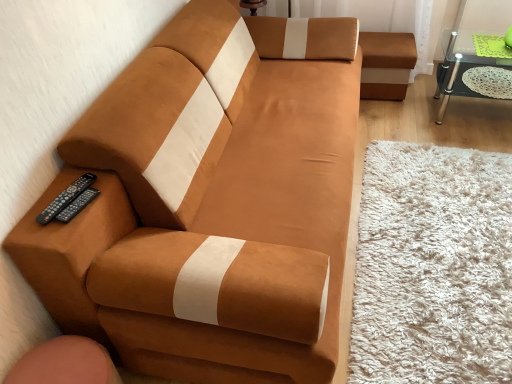
Measure the distance between black plastic remote at lower left, which is counted as the second remote, starting from the right, and camera.

black plastic remote at lower left, which is counted as the second remote, starting from the right, is 1.25 meters away from camera.

In order to face suede-like brown couch at left, should I rotate leftwards or rightwards?

To face it directly, rotate left by 0.041 degrees.

Describe the element at coordinates (77, 205) in the screenshot. I see `black plastic remote at lower left, the 1th remote when ordered from right to left` at that location.

Identify the location of black plastic remote at lower left, which is counted as the second remote, starting from the right. 65,198.

Which is less distant, (93,257) or (467,88)?

Positioned in front is point (93,257).

From the image's perspective, which one is positioned lower, suede-like brown couch at left or transparent glass table at upper right?

suede-like brown couch at left is shown below in the image.

Does suede-like brown couch at left appear on the right side of transparent glass table at upper right?

No, suede-like brown couch at left is not to the right of transparent glass table at upper right.

From a real-world perspective, between suede-like brown couch at left and transparent glass table at upper right, who is vertically lower?

transparent glass table at upper right is physically lower.

Is suede-like brown couch at left facing towards black plastic remote at lower left, the 1th remote when ordered from right to left?

No, suede-like brown couch at left is not facing towards black plastic remote at lower left, the 1th remote when ordered from right to left.

From their relative heights in the image, would you say suede-like brown couch at left is taller or shorter than black plastic remote at lower left, positioned as the second remote in left-to-right order?

suede-like brown couch at left is taller than black plastic remote at lower left, positioned as the second remote in left-to-right order.

Considering the relative positions of suede-like brown couch at left and black plastic remote at lower left, the 1th remote when ordered from right to left, in the image provided, is suede-like brown couch at left to the left of black plastic remote at lower left, the 1th remote when ordered from right to left, from the viewer's perspective?

No.

Locate an element on the screen. Image resolution: width=512 pixels, height=384 pixels. remote that is the 1st object to the left of the suede-like brown couch at left, starting at the anchor is located at coordinates (77, 205).

In terms of width, does black plastic remote at lower left, which ranks as the first remote in left-to-right order, look wider or thinner when compared to black plastic remote at lower left, the 1th remote when ordered from right to left?

In the image, black plastic remote at lower left, which ranks as the first remote in left-to-right order, appears to be wider than black plastic remote at lower left, the 1th remote when ordered from right to left.

What's the angular difference between black plastic remote at lower left, which is counted as the second remote, starting from the right, and black plastic remote at lower left, positioned as the second remote in left-to-right order,'s facing directions?

6.25 degrees separate the facing orientations of black plastic remote at lower left, which is counted as the second remote, starting from the right, and black plastic remote at lower left, positioned as the second remote in left-to-right order.

From a real-world perspective, is black plastic remote at lower left, which ranks as the first remote in left-to-right order, above or below black plastic remote at lower left, the 1th remote when ordered from right to left?

black plastic remote at lower left, which ranks as the first remote in left-to-right order, is situated lower than black plastic remote at lower left, the 1th remote when ordered from right to left, in the real world.

From the image's perspective, which is below, black plastic remote at lower left, which is counted as the second remote, starting from the right, or black plastic remote at lower left, positioned as the second remote in left-to-right order?

black plastic remote at lower left, positioned as the second remote in left-to-right order, from the image's perspective.

Does black plastic remote at lower left, the 1th remote when ordered from right to left, lie behind transparent glass table at upper right?

No, it is in front of transparent glass table at upper right.

Find the location of a particular element. remote that is the 2nd object located in front of the transparent glass table at upper right is located at coordinates (77, 205).

Can you confirm if black plastic remote at lower left, positioned as the second remote in left-to-right order, is shorter than transparent glass table at upper right?

Yes.

Is point (71, 200) positioned after point (101, 304)?

That is True.

From a real-world perspective, is black plastic remote at lower left, the 1th remote when ordered from right to left, located beneath suede-like brown couch at left?

No, from a real-world perspective, black plastic remote at lower left, the 1th remote when ordered from right to left, is not under suede-like brown couch at left.

Is suede-like brown couch at left completely or partially inside black plastic remote at lower left, positioned as the second remote in left-to-right order?

That's incorrect, suede-like brown couch at left is not inside black plastic remote at lower left, positioned as the second remote in left-to-right order.

From the image's perspective, is black plastic remote at lower left, the 1th remote when ordered from right to left, on suede-like brown couch at left?

Incorrect, from the image's perspective, black plastic remote at lower left, the 1th remote when ordered from right to left, is lower than suede-like brown couch at left.

Is black plastic remote at lower left, which ranks as the first remote in left-to-right order, oriented away from suede-like brown couch at left?

Yes.

Is black plastic remote at lower left, which is counted as the second remote, starting from the right, beside suede-like brown couch at left?

No, black plastic remote at lower left, which is counted as the second remote, starting from the right, is not touching suede-like brown couch at left.

From a real-world perspective, who is located lower, black plastic remote at lower left, which ranks as the first remote in left-to-right order, or suede-like brown couch at left?

suede-like brown couch at left.

What's the angular difference between black plastic remote at lower left, which ranks as the first remote in left-to-right order, and suede-like brown couch at left's facing directions?

The facing directions of black plastic remote at lower left, which ranks as the first remote in left-to-right order, and suede-like brown couch at left are 13 degrees apart.

How much distance is there between black plastic remote at lower left, the 1th remote when ordered from right to left, and black plastic remote at lower left, which is counted as the second remote, starting from the right?

black plastic remote at lower left, the 1th remote when ordered from right to left, and black plastic remote at lower left, which is counted as the second remote, starting from the right, are 1.16 inches apart from each other.

From the image's perspective, which object appears higher, black plastic remote at lower left, the 1th remote when ordered from right to left, or black plastic remote at lower left, which is counted as the second remote, starting from the right?

From the image's view, black plastic remote at lower left, which is counted as the second remote, starting from the right, is above.

Looking at this image, is black plastic remote at lower left, positioned as the second remote in left-to-right order, at the left side of black plastic remote at lower left, which ranks as the first remote in left-to-right order?

No.

Based on the photo, is black plastic remote at lower left, positioned as the second remote in left-to-right order, completely or partially outside of black plastic remote at lower left, which is counted as the second remote, starting from the right?

Yes, black plastic remote at lower left, positioned as the second remote in left-to-right order, is outside of black plastic remote at lower left, which is counted as the second remote, starting from the right.

At what (x,y) coordinates should I click in order to perform the action: click on studio couch lying on the left of transparent glass table at upper right. Please return your answer as a coordinate pair (x, y). Looking at the image, I should click on (210, 202).

The height and width of the screenshot is (384, 512). In the image, there is a black plastic remote at lower left, positioned as the second remote in left-to-right order. Find the location of `studio couch below it (from a real-world perspective)`. studio couch below it (from a real-world perspective) is located at coordinates (210, 202).

Which object lies nearer to the anchor point suede-like brown couch at left, black plastic remote at lower left, positioned as the second remote in left-to-right order, or transparent glass table at upper right?

black plastic remote at lower left, positioned as the second remote in left-to-right order, is closer to suede-like brown couch at left.

When comparing their distances from black plastic remote at lower left, which is counted as the second remote, starting from the right, does suede-like brown couch at left or transparent glass table at upper right seem closer?

suede-like brown couch at left is closer to black plastic remote at lower left, which is counted as the second remote, starting from the right.

Looking at the image, which one is located closer to transparent glass table at upper right, black plastic remote at lower left, positioned as the second remote in left-to-right order, or suede-like brown couch at left?

Based on the image, suede-like brown couch at left appears to be nearer to transparent glass table at upper right.

From the image, which object appears to be farther from transparent glass table at upper right, black plastic remote at lower left, the 1th remote when ordered from right to left, or black plastic remote at lower left, which is counted as the second remote, starting from the right?

Based on the image, black plastic remote at lower left, the 1th remote when ordered from right to left, appears to be further to transparent glass table at upper right.

When comparing their distances from black plastic remote at lower left, which is counted as the second remote, starting from the right, does transparent glass table at upper right or suede-like brown couch at left seem closer?

suede-like brown couch at left is closer to black plastic remote at lower left, which is counted as the second remote, starting from the right.

Based on their spatial positions, is transparent glass table at upper right or black plastic remote at lower left, the 1th remote when ordered from right to left, closer to suede-like brown couch at left?

Based on the image, black plastic remote at lower left, the 1th remote when ordered from right to left, appears to be nearer to suede-like brown couch at left.

Considering their positions, is suede-like brown couch at left positioned further to transparent glass table at upper right than black plastic remote at lower left, which is counted as the second remote, starting from the right?

black plastic remote at lower left, which is counted as the second remote, starting from the right.

Based on their spatial positions, is black plastic remote at lower left, which ranks as the first remote in left-to-right order, or suede-like brown couch at left closer to transparent glass table at upper right?

suede-like brown couch at left is positioned closer to the anchor transparent glass table at upper right.

You are a GUI agent. You are given a task and a screenshot of the screen. Output one action in this format:
    pyautogui.click(x=<x>, y=<y>)
    Task: Click on the studio couch between black plastic remote at lower left, which ranks as the first remote in left-to-right order, and transparent glass table at upper right
    
    Given the screenshot: What is the action you would take?
    pyautogui.click(x=210, y=202)

At what (x,y) coordinates should I click in order to perform the action: click on remote situated between black plastic remote at lower left, which is counted as the second remote, starting from the right, and transparent glass table at upper right from left to right. Please return your answer as a coordinate pair (x, y). This screenshot has width=512, height=384. Looking at the image, I should click on [77, 205].

At what (x,y) coordinates should I click in order to perform the action: click on remote between black plastic remote at lower left, which is counted as the second remote, starting from the right, and suede-like brown couch at left from left to right. Please return your answer as a coordinate pair (x, y). Looking at the image, I should click on (77, 205).

This screenshot has height=384, width=512. What are the coordinates of `studio couch located between black plastic remote at lower left, the 1th remote when ordered from right to left, and transparent glass table at upper right in the left-right direction` in the screenshot? It's located at (210, 202).